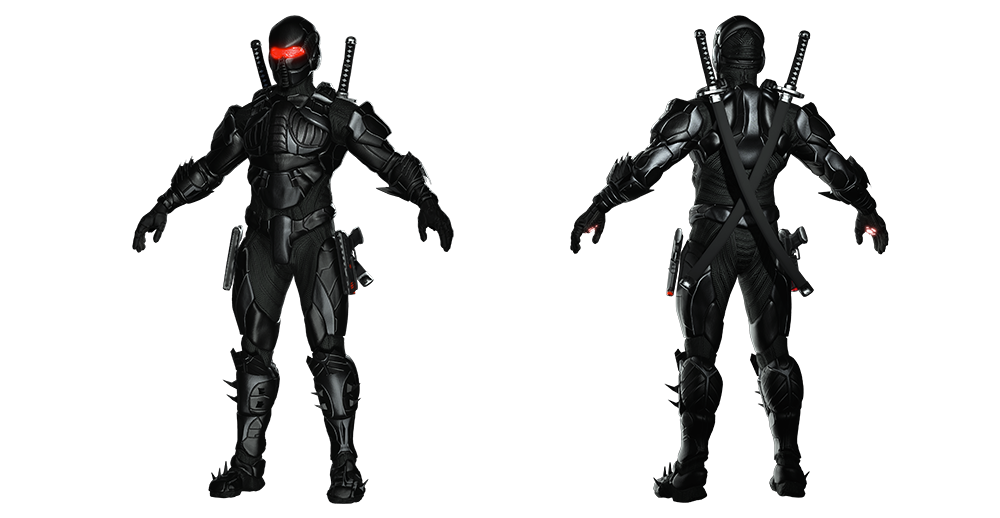
Where is `shades`? The image size is (1000, 518). shades is located at coordinates (284, 48).